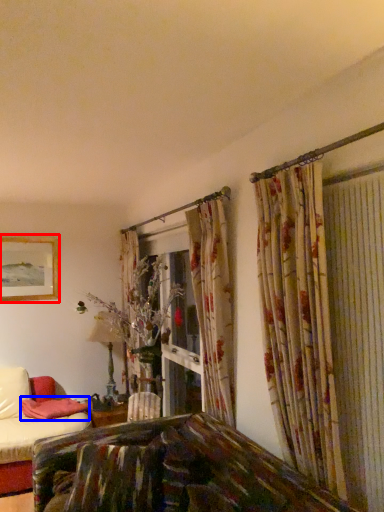
Question: Which object is further to the camera taking this photo, picture frame (highlighted by a red box) or pillow (highlighted by a blue box)?

Choices:
 (A) picture frame
 (B) pillow

Answer: (A)